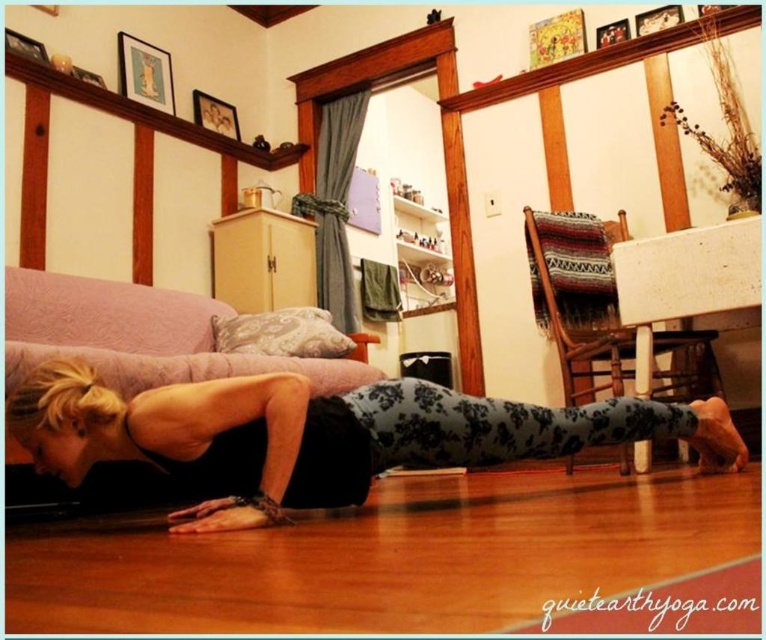
Question: Is black floral leggings at lower center smaller than pink fabric couch at lower left?

Choices:
 (A) yes
 (B) no

Answer: (B)

Question: Does black floral leggings at lower center come in front of pink fabric couch at lower left?

Choices:
 (A) yes
 (B) no

Answer: (A)

Question: Observing the image, what is the correct spatial positioning of black floral leggings at lower center in reference to pink fabric couch at lower left?

Choices:
 (A) below
 (B) above

Answer: (A)

Question: Which of the following is the closest to the observer?

Choices:
 (A) (169, 362)
 (B) (714, 444)

Answer: (B)